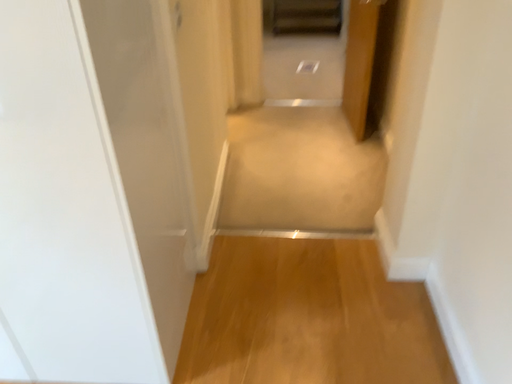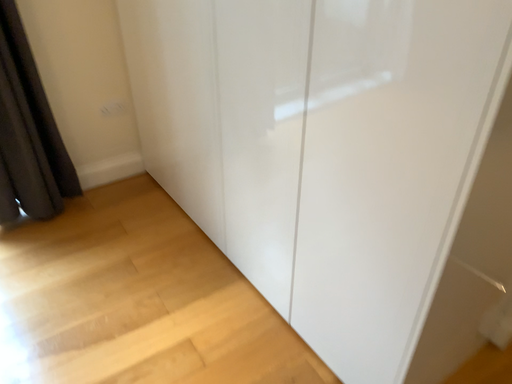
Question: Which way did the camera rotate in the video?

Choices:
 (A) rotated upward
 (B) rotated downward

Answer: (A)